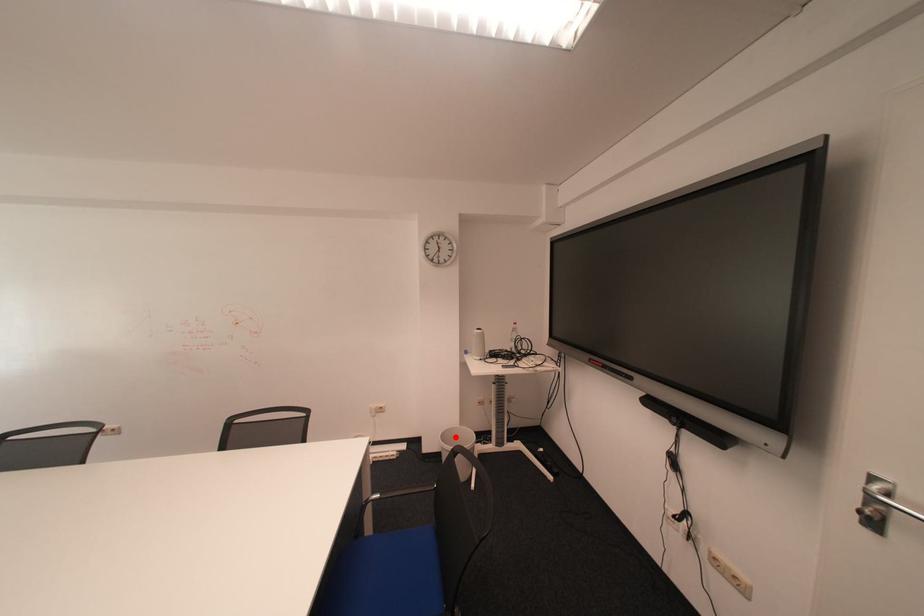
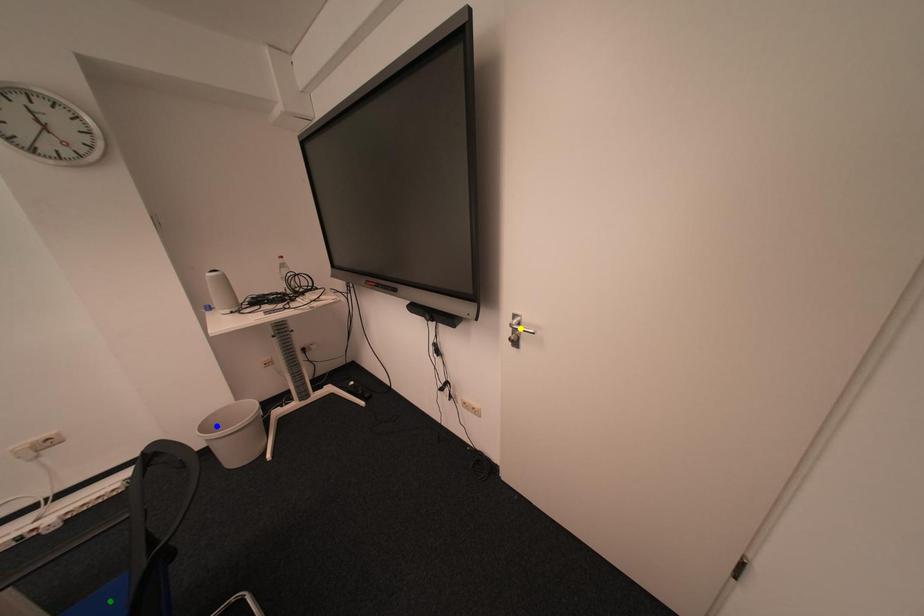
Question: I am providing you with two images of the same scene from different viewpoints. A red point is marked on the first image. You are given multiple points on the second image. Which point in image 2 represents the same 3d spot as the red point in image 1?

Choices:
 (A) blue point
 (B) green point
 (C) yellow point

Answer: (A)